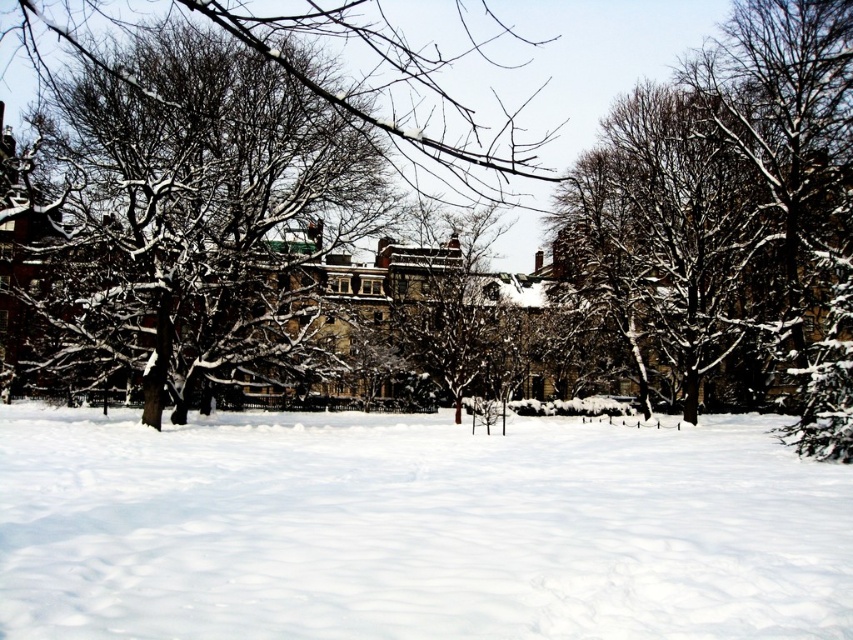
Question: Which of the following is the farthest from the observer?

Choices:
 (A) click(x=447, y=259)
 (B) click(x=49, y=422)

Answer: (A)

Question: Which object is farther from the camera taking this photo?

Choices:
 (A) snow-covered tree at left
 (B) snow-covered tree at center

Answer: (B)

Question: Considering the relative positions of white fluffy snow at center and snow-covered tree at left in the image provided, where is white fluffy snow at center located with respect to snow-covered tree at left?

Choices:
 (A) below
 (B) above

Answer: (A)

Question: Which of the following is the farthest from the observer?

Choices:
 (A) snow-covered tree at left
 (B) white fluffy snow at center
 (C) snow-covered tree at center

Answer: (C)

Question: From the image, what is the correct spatial relationship of white fluffy snow at center in relation to snow-covered tree at center?

Choices:
 (A) above
 (B) below

Answer: (B)

Question: Is white fluffy snow at center below snow-covered tree at center?

Choices:
 (A) no
 (B) yes

Answer: (B)